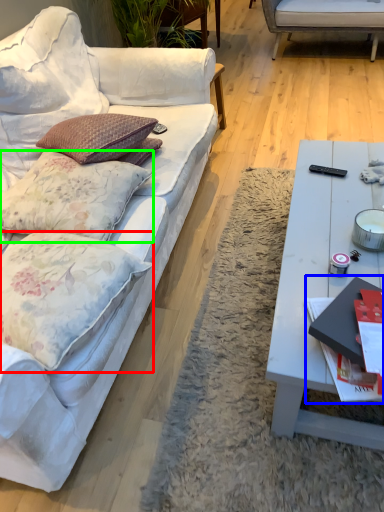
Question: Estimate the real-world distances between objects in this image. Which object is closer to pillow (highlighted by a red box), magazine (highlighted by a blue box) or pillow (highlighted by a green box)?

Choices:
 (A) magazine
 (B) pillow

Answer: (B)